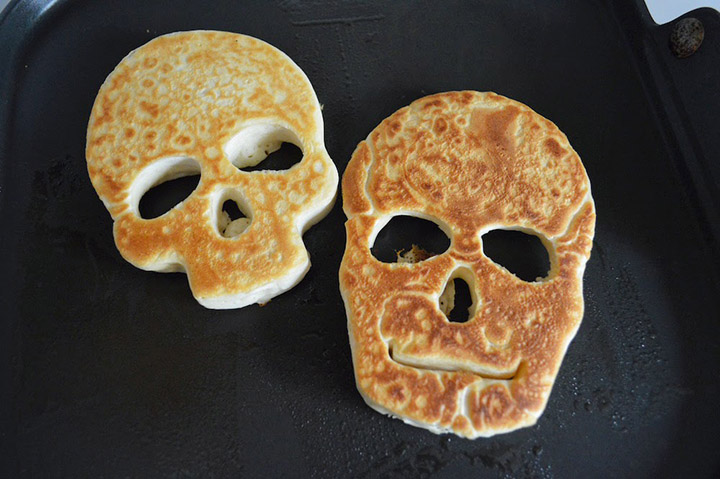
What are the coordinates of `top left corner empty space` in the screenshot? It's located at (x=11, y=5).